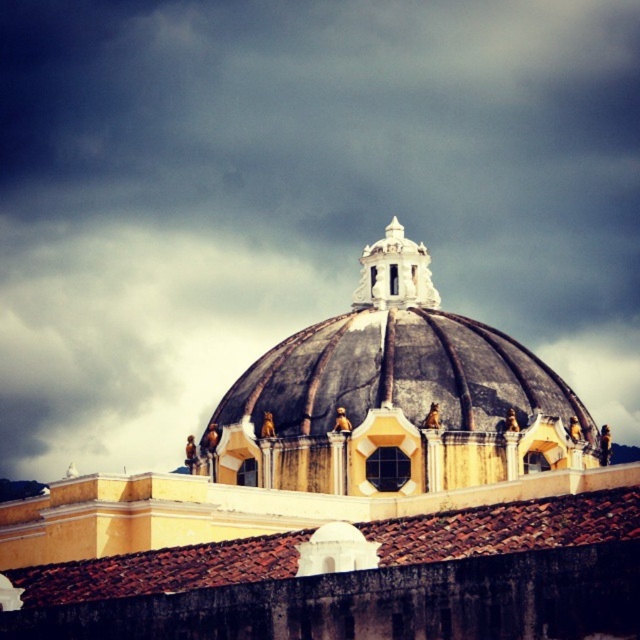
Looking at this image, is smooth yellow dome at center smaller than brown tile roof at center?

No, smooth yellow dome at center is not smaller than brown tile roof at center.

Between smooth yellow dome at center and brown tile roof at center, which one is positioned lower?

smooth yellow dome at center is below.

Locate an element on the screen. smooth yellow dome at center is located at coordinates (348, 506).

In the scene shown: Is brown tile roof at center wider than white stone spire at center?

Yes, brown tile roof at center is wider than white stone spire at center.

Is brown tile roof at center further to the viewer compared to white stone spire at center?

No, it is in front of white stone spire at center.

Where is `brown tile roof at center`? brown tile roof at center is located at coordinates (508, 528).

Does dark gray stone dome at center have a smaller size compared to white stone spire at center?

Yes.

Is dark gray stone dome at center below white stone spire at center?

Yes, dark gray stone dome at center is below white stone spire at center.

Describe the element at coordinates (394, 397) in the screenshot. I see `dark gray stone dome at center` at that location.

Locate an element on the screen. This screenshot has height=640, width=640. dark gray stone dome at center is located at coordinates (394, 397).